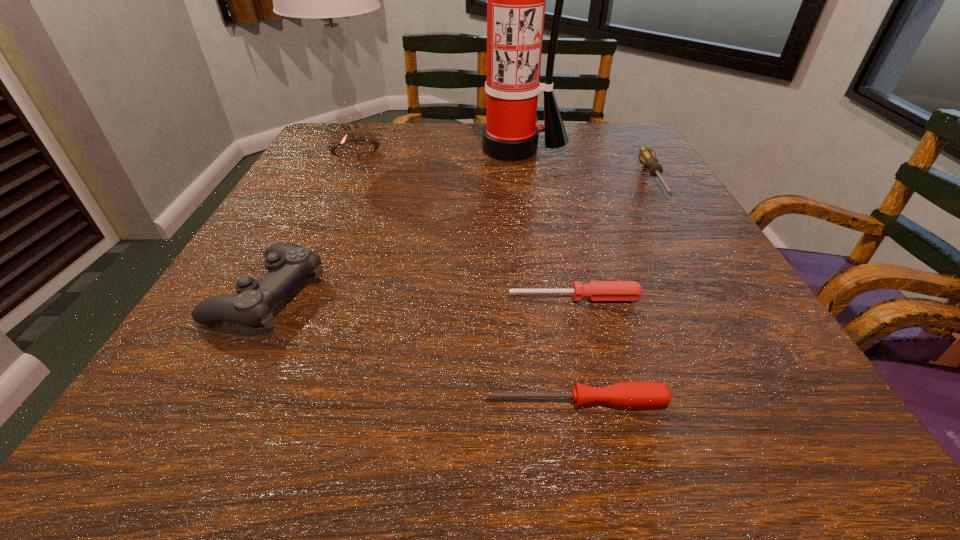
The width and height of the screenshot is (960, 540). Find the location of `free space in the image that satisfies the following two spatial constraints: 1. at the nozzle of the fire extinguisher; 2. on the front-facing side of the table lamp`. free space in the image that satisfies the following two spatial constraints: 1. at the nozzle of the fire extinguisher; 2. on the front-facing side of the table lamp is located at coordinates (515, 149).